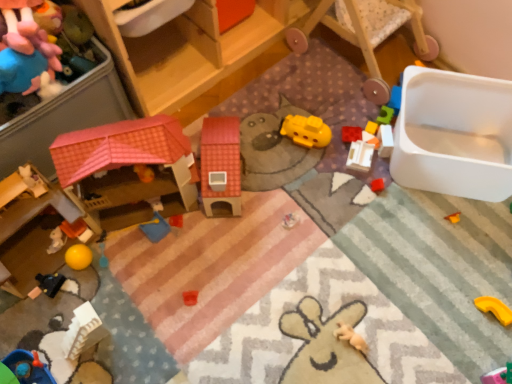
Where is `free space to the left of white plastic blocks at right, which is the second toy in right-to-left order`? free space to the left of white plastic blocks at right, which is the second toy in right-to-left order is located at coordinates 331,151.